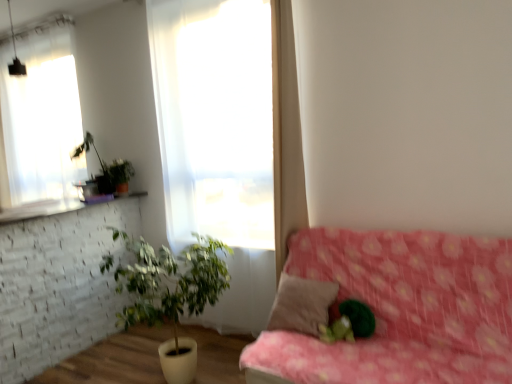
Question: From the image's perspective, would you say pink floral fabric couch at lower right is shown under green leafy plant in white pot at lower left, the 2th houseplant in the top-to-bottom sequence?

Choices:
 (A) no
 (B) yes

Answer: (A)

Question: From the image's perspective, is pink floral fabric couch at lower right above green leafy plant in white pot at lower left, placed as the second houseplant when sorted from back to front?

Choices:
 (A) no
 (B) yes

Answer: (B)

Question: Considering the relative sizes of pink floral fabric couch at lower right and green leafy plant in white pot at lower left, which is the 1th houseplant from front to back, in the image provided, is pink floral fabric couch at lower right bigger than green leafy plant in white pot at lower left, which is the 1th houseplant from front to back,?

Choices:
 (A) no
 (B) yes

Answer: (B)

Question: Considering the relative sizes of pink floral fabric couch at lower right and green leafy plant in white pot at lower left, which is the 1th houseplant from front to back, in the image provided, is pink floral fabric couch at lower right wider than green leafy plant in white pot at lower left, which is the 1th houseplant from front to back,?

Choices:
 (A) no
 (B) yes

Answer: (A)

Question: Is pink floral fabric couch at lower right facing towards green leafy plant in white pot at lower left, placed as the second houseplant when sorted from back to front?

Choices:
 (A) yes
 (B) no

Answer: (B)

Question: Is pink floral fabric couch at lower right at the right side of green leafy plant in white pot at lower left, which is the 1th houseplant from front to back?

Choices:
 (A) yes
 (B) no

Answer: (A)

Question: Is white sheer curtain at upper left, the first window when ordered from back to front, facing away from brown fabric pillow at center?

Choices:
 (A) yes
 (B) no

Answer: (B)

Question: Does white sheer curtain at upper left, acting as the 2th window starting from the front, have a greater height compared to brown fabric pillow at center?

Choices:
 (A) yes
 (B) no

Answer: (A)

Question: From the image's perspective, is white sheer curtain at upper left, the 1th window from the left, on top of brown fabric pillow at center?

Choices:
 (A) no
 (B) yes

Answer: (B)

Question: Does white sheer curtain at upper left, acting as the 2th window starting from the front, appear on the left side of brown fabric pillow at center?

Choices:
 (A) yes
 (B) no

Answer: (A)

Question: Would you say white sheer curtain at upper left, the second window from the right, contains brown fabric pillow at center?

Choices:
 (A) no
 (B) yes

Answer: (A)

Question: Is white sheer curtain at upper left, the second window from the right, not inside brown fabric pillow at center?

Choices:
 (A) no
 (B) yes

Answer: (B)

Question: Can we say green leafy plant at upper left, placed as the 1th houseplant when sorted from top to bottom, lies outside pink floral fabric couch at lower right?

Choices:
 (A) yes
 (B) no

Answer: (A)